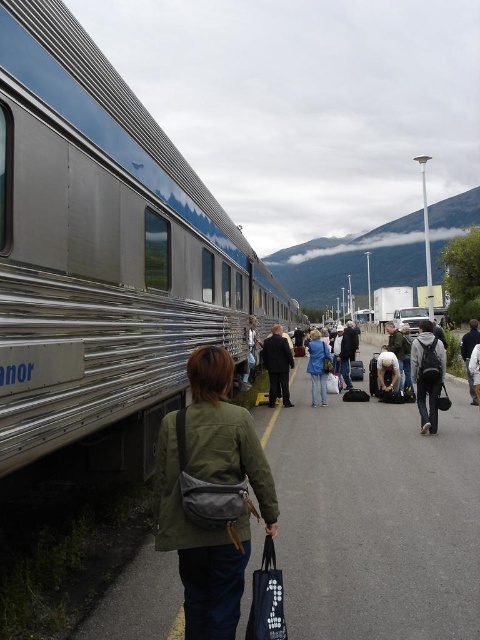
You are a passenger on the platform and need to quickly grab your belongings before the train departs. You see the green fabric bag at lower center and the blue denim jeans at center. Which item is closer to the yellow safety line?

The green fabric bag at lower center is shorter than the blue denim jeans at center, so it is closer to the yellow safety line.

You are a passenger on the train station platform. You have a green fabric bag at lower center and blue denim jeans at center nearby. Which item is narrower when viewed from above?

The green fabric bag at lower center is thinner than the blue denim jeans at center, so the green fabric bag at lower center is narrower when viewed from above.

You are a passenger on the platform and need to place your black fabric bag at lower center and dark gray backpack at center into a storage compartment that can only hold one item at a time. Based on their sizes, which item should you place first to ensure both fit?

The black fabric bag at lower center occupies less space than the dark gray backpack at center, so you should place the dark gray backpack at center first to leave enough space for the smaller bag.